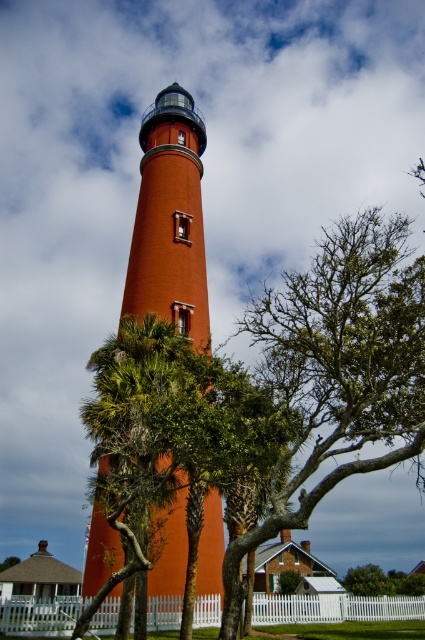
You are a painter wanting to capture the scene of the smooth orange lighthouse at center and the green leafy tree at center. Which object appears wider in your painting?

The green leafy tree at center appears wider than the smooth orange lighthouse at center in the painting because its width is larger.

You are a visitor at the lighthouse and want to take a photo that includes both the green leafy palm tree at center and the smooth orange lighthouse at center. Based on their sizes, which object should you frame first in your camera to ensure both are visible in the shot?

The green leafy palm tree at center is larger than the smooth orange lighthouse at center, so you should frame the palm tree first to ensure both fit in the photo.

You are standing at the lighthouse and want to take a photo of both the point at coordinates (408, 376) and the point at (201, 506). Which point will appear larger in your camera view?

The point at coordinates (408, 376) will appear larger in the camera view because it is closer to the camera than the point at (201, 506).